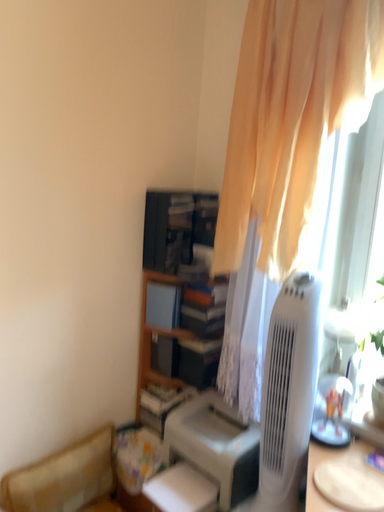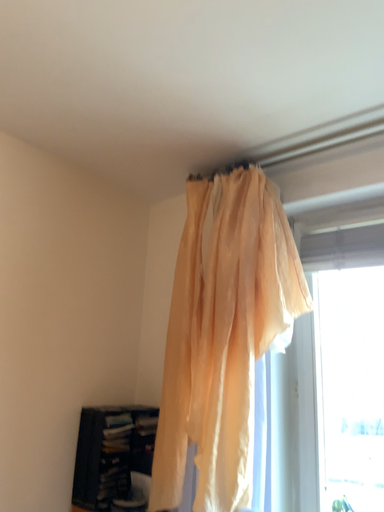
Question: Which way did the camera rotate in the video?

Choices:
 (A) rotated downward
 (B) rotated upward

Answer: (B)